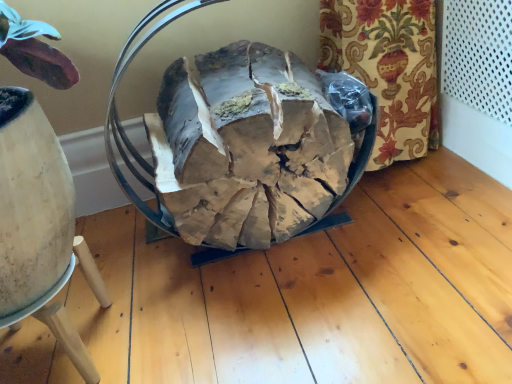
The height and width of the screenshot is (384, 512). What do you see at coordinates (249, 148) in the screenshot?
I see `natural wood firewood at center` at bounding box center [249, 148].

Locate an element on the screen. natural wood firewood at center is located at coordinates (249, 148).

The height and width of the screenshot is (384, 512). What do you see at coordinates (66, 312) in the screenshot?
I see `wooden stool at lower left` at bounding box center [66, 312].

What is the approximate height of wooden stool at lower left?

The height of wooden stool at lower left is 6.43 inches.

Where is `wooden stool at lower left`? wooden stool at lower left is located at coordinates (66, 312).

Locate an element on the screen. Image resolution: width=512 pixels, height=384 pixels. natural wood firewood at center is located at coordinates (249, 148).

Between natural wood firewood at center and wooden stool at lower left, which one appears on the right side from the viewer's perspective?

natural wood firewood at center.

Does natural wood firewood at center lie in front of wooden stool at lower left?

No, natural wood firewood at center is further to the viewer.

Does point (252, 55) come in front of point (110, 305)?

No, it is behind (110, 305).

From the image's perspective, is natural wood firewood at center on wooden stool at lower left?

Correct, natural wood firewood at center appears higher than wooden stool at lower left in the image.

From a real-world perspective, is natural wood firewood at center physically above wooden stool at lower left?

Yes.

Based on the photo, can you confirm if natural wood firewood at center is thinner than wooden stool at lower left?

No.

Considering the sizes of natural wood firewood at center and wooden stool at lower left in the image, is natural wood firewood at center taller or shorter than wooden stool at lower left?

Considering their sizes, natural wood firewood at center has more height than wooden stool at lower left.

Based on their sizes in the image, would you say natural wood firewood at center is bigger or smaller than wooden stool at lower left?

natural wood firewood at center is bigger than wooden stool at lower left.

Based on the photo, is wooden stool at lower left surrounded by natural wood firewood at center?

No, wooden stool at lower left is located outside of natural wood firewood at center.

Would you say natural wood firewood at center is a long distance from wooden stool at lower left?

That's not correct — natural wood firewood at center is a little close to wooden stool at lower left.

Is natural wood firewood at center positioned with its back to wooden stool at lower left?

No, natural wood firewood at center's orientation is not away from wooden stool at lower left.

Can you tell me how much natural wood firewood at center and wooden stool at lower left differ in facing direction?

The angular difference between natural wood firewood at center and wooden stool at lower left is 1.49 degrees.

How distant is natural wood firewood at center from wooden stool at lower left?

natural wood firewood at center is 13.71 inches from wooden stool at lower left.

You are a GUI agent. You are given a task and a screenshot of the screen. Output one action in this format:
    pyautogui.click(x=<x>, y=<y>)
    Task: Click on the furniture lying below the natural wood firewood at center (from the image's perspective)
    This screenshot has height=384, width=512.
    Given the screenshot: What is the action you would take?
    pyautogui.click(x=66, y=312)

Is wooden stool at lower left to the left or to the right of natural wood firewood at center in the image?

wooden stool at lower left is positioned on natural wood firewood at center's left side.

Relative to natural wood firewood at center, is wooden stool at lower left in front or behind?

wooden stool at lower left is in front of natural wood firewood at center.

Between point (42, 315) and point (173, 140), which one is positioned behind?

Point (173, 140)

From the image's perspective, is wooden stool at lower left located above or below natural wood firewood at center?

wooden stool at lower left is below natural wood firewood at center.

From a real-world perspective, is wooden stool at lower left over natural wood firewood at center?

Actually, wooden stool at lower left is physically below natural wood firewood at center in the real world.

From the picture: Looking at their sizes, would you say wooden stool at lower left is wider or thinner than natural wood firewood at center?

In the image, wooden stool at lower left appears to be more narrow than natural wood firewood at center.

Can you confirm if wooden stool at lower left is taller than natural wood firewood at center?

Incorrect, the height of wooden stool at lower left is not larger of that of natural wood firewood at center.

Is wooden stool at lower left bigger than natural wood firewood at center?

No.

Is wooden stool at lower left inside the boundaries of natural wood firewood at center, or outside?

wooden stool at lower left cannot be found inside natural wood firewood at center.

Would you consider wooden stool at lower left to be distant from natural wood firewood at center?

No, wooden stool at lower left is not far from natural wood firewood at center.

Is wooden stool at lower left aimed at natural wood firewood at center?

No, wooden stool at lower left is not facing towards natural wood firewood at center.

How many degrees apart are the facing directions of wooden stool at lower left and natural wood firewood at center?

They differ by 1.49 degrees in their facing directions.

Locate an element on the screen. This screenshot has height=384, width=512. food on the right of the wooden stool at lower left is located at coordinates (249, 148).

At what (x,y) coordinates should I click in order to perform the action: click on furniture located below the natural wood firewood at center (from the image's perspective). Please return your answer as a coordinate pair (x, y). The height and width of the screenshot is (384, 512). Looking at the image, I should click on (66, 312).

At what (x,y) coordinates should I click in order to perform the action: click on furniture below the natural wood firewood at center (from a real-world perspective). Please return your answer as a coordinate pair (x, y). Image resolution: width=512 pixels, height=384 pixels. Looking at the image, I should click on (66, 312).